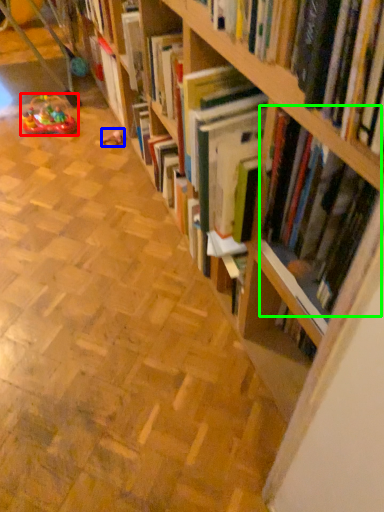
Question: Which is nearer to the toy (highlighted by a red box)? toy (highlighted by a blue box) or book (highlighted by a green box).

Choices:
 (A) toy
 (B) book

Answer: (A)